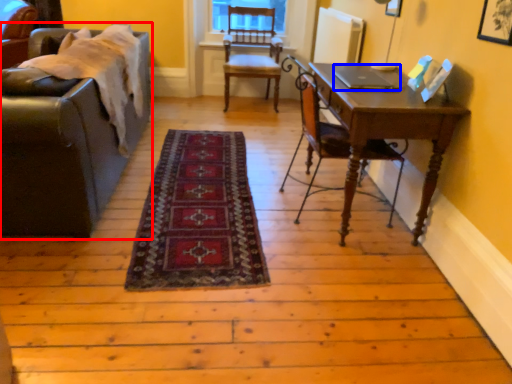
Question: Which object appears farthest to the camera in this image, studio couch (highlighted by a red box) or laptop (highlighted by a blue box)?

Choices:
 (A) studio couch
 (B) laptop

Answer: (B)